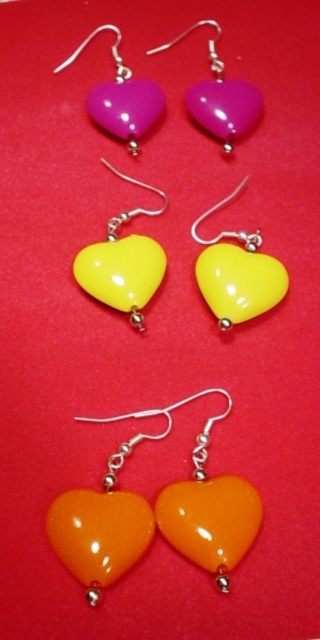
Question: Which object is closer to the camera taking this photo?

Choices:
 (A) orange glossy heart at bottom
 (B) glossy plastic heart at upper center
 (C) purple glossy heart at upper center

Answer: (A)

Question: Observing the image, what is the correct spatial positioning of glossy orange heart at bottom in reference to glossy plastic heart at center?

Choices:
 (A) above
 (B) below

Answer: (B)

Question: Is glossy orange heart at bottom below purple glossy heart at upper center?

Choices:
 (A) no
 (B) yes

Answer: (B)

Question: Which object is positioned closest to the purple glossy heart at upper center?

Choices:
 (A) glossy plastic heart at center
 (B) glossy orange heart at bottom
 (C) orange glossy heart at bottom

Answer: (A)

Question: Considering the relative positions of glossy plastic heart at center and glossy plastic heart at upper center in the image provided, where is glossy plastic heart at center located with respect to glossy plastic heart at upper center?

Choices:
 (A) right
 (B) left

Answer: (A)

Question: Which point is farther to the camera?

Choices:
 (A) glossy plastic heart at upper center
 (B) orange glossy heart at bottom
 (C) yellow glossy heart at center

Answer: (A)